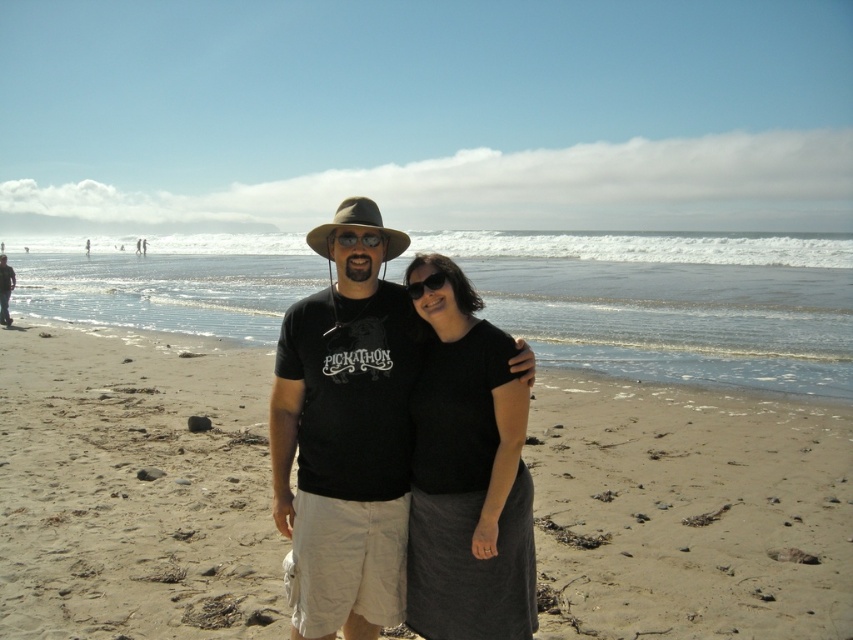
Question: Estimate the real-world distances between objects in this image. Which object is closer to the black cotton t-shirt at center?

Choices:
 (A) matte black goggles at center
 (B) black matte skirt at center
 (C) brown fabric hat at center

Answer: (B)

Question: From the image, what is the correct spatial relationship of sandy beach at center in relation to black cotton t-shirt at center?

Choices:
 (A) above
 (B) below

Answer: (B)

Question: Based on their relative distances, which object is nearer to the brown fabric hat at center?

Choices:
 (A) black matte skirt at center
 (B) matte black t-shirt at center
 (C) sandy beach at center
 (D) matte black goggles at center

Answer: (D)

Question: Which point is closer to the camera taking this photo?

Choices:
 (A) (341, 476)
 (B) (740, 589)

Answer: (A)

Question: Can you confirm if black matte skirt at center is wider than brown fabric hat at center?

Choices:
 (A) no
 (B) yes

Answer: (A)

Question: Is brown fabric hat at center smaller than matte black goggles at center?

Choices:
 (A) no
 (B) yes

Answer: (A)